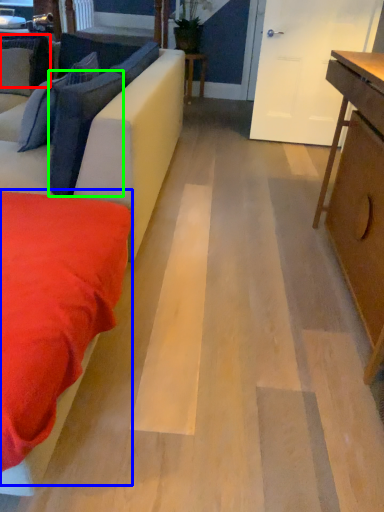
Question: Which object is positioned farthest from pillow (highlighted by a red box)? Select from bedding (highlighted by a blue box) and pillow (highlighted by a green box).

Choices:
 (A) bedding
 (B) pillow

Answer: (A)